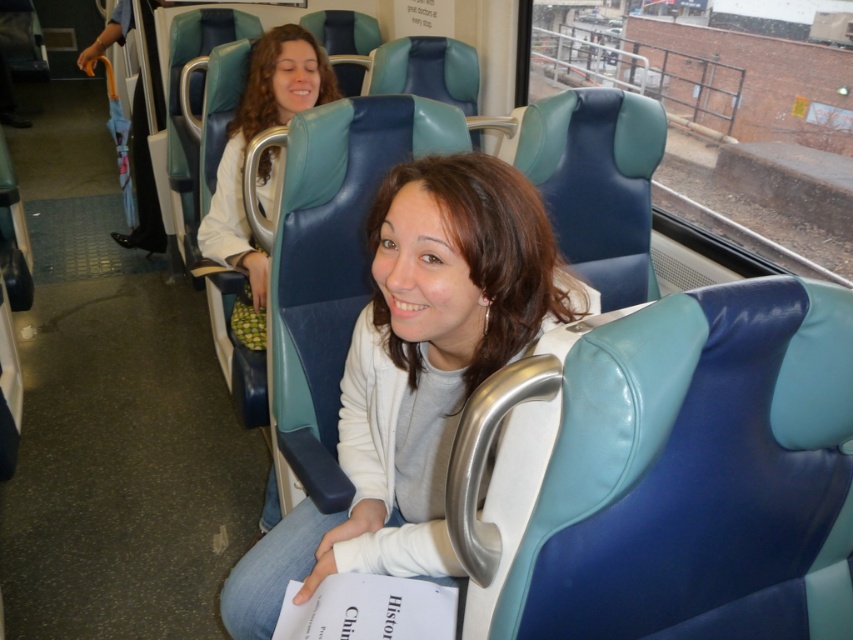
Question: Where is matte blue jacket at center located in relation to matte white shirt at upper center in the image?

Choices:
 (A) above
 (B) below

Answer: (B)

Question: Which object is closer to the camera taking this photo?

Choices:
 (A) matte white shirt at upper center
 (B) matte blue jacket at center

Answer: (B)

Question: Is matte blue jacket at center to the right of matte white shirt at upper center from the viewer's perspective?

Choices:
 (A) yes
 (B) no

Answer: (A)

Question: Where is matte blue jacket at center located in relation to matte white shirt at upper center in the image?

Choices:
 (A) below
 (B) above

Answer: (A)